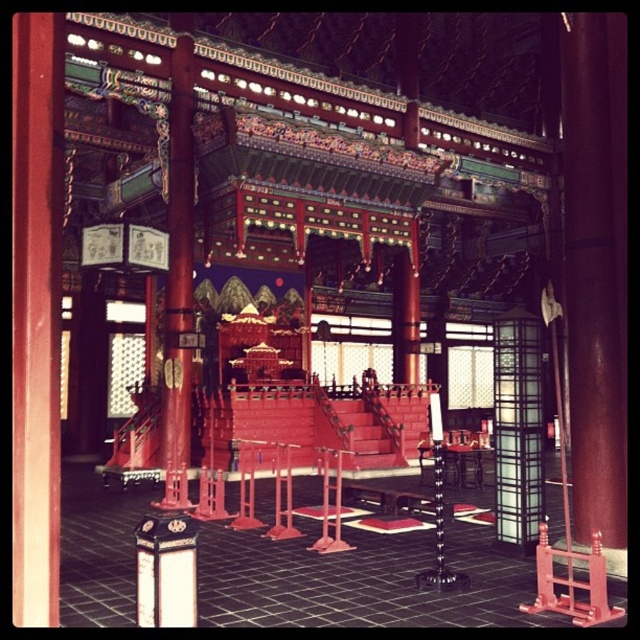
Question: Observing the image, what is the correct spatial positioning of smooth wood pillar at center in reference to smooth polished wood pole at left?

Choices:
 (A) above
 (B) below

Answer: (A)

Question: Which of the following is the closest to the observer?

Choices:
 (A) smooth wood pillar at center
 (B) smooth polished wood pole at left
 (C) black glass lantern at center

Answer: (A)

Question: Based on their relative distances, which object is farther from the black glass lantern at center?

Choices:
 (A) smooth wood pillar at center
 (B) smooth polished wood pole at left

Answer: (B)

Question: Is smooth wood pillar at center above smooth polished wood pole at left?

Choices:
 (A) no
 (B) yes

Answer: (B)

Question: Does smooth polished wood pole at left have a smaller size compared to black glass lantern at center?

Choices:
 (A) yes
 (B) no

Answer: (A)

Question: Among these points, which one is farthest from the camera?

Choices:
 (A) (504, 394)
 (B) (182, 54)
 (C) (579, 42)

Answer: (B)